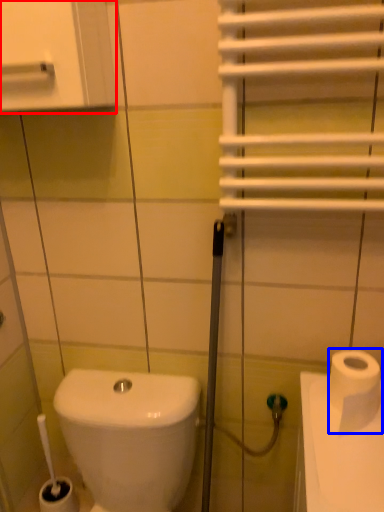
Question: Which of the following is the farthest to the observer, medicine cabinet (highlighted by a red box) or toilet paper (highlighted by a blue box)?

Choices:
 (A) medicine cabinet
 (B) toilet paper

Answer: (B)